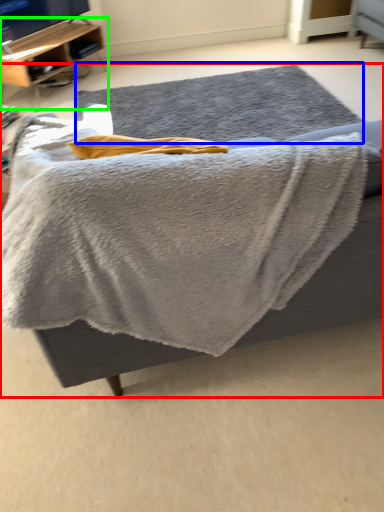
Question: Which object is positioned farthest from furniture (highlighted by a red box)? Select from mat (highlighted by a blue box) and shelf (highlighted by a green box).

Choices:
 (A) mat
 (B) shelf

Answer: (B)